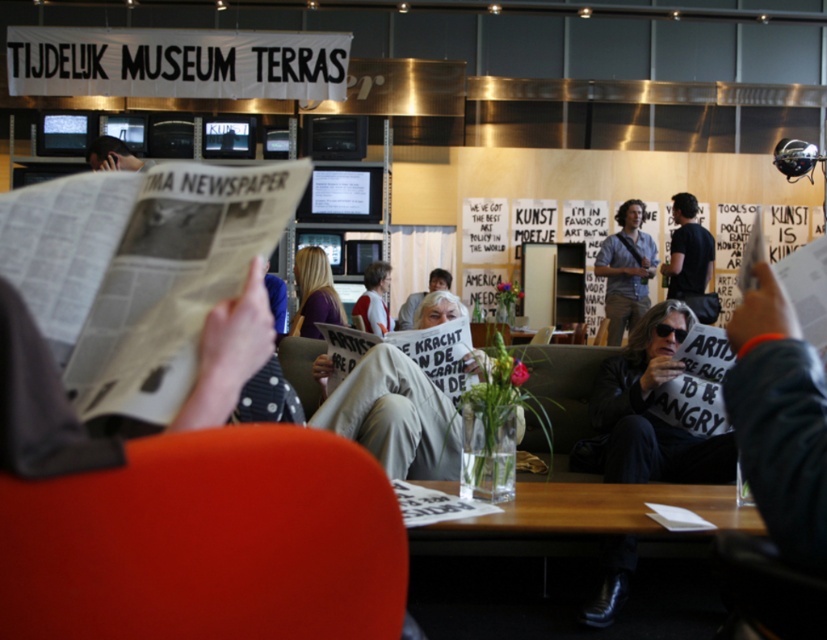
Is purple fabric shirt at center wider than white paper banner at center?

No.

Does purple fabric shirt at center appear over white paper banner at center?

No, purple fabric shirt at center is not above white paper banner at center.

Between point (327, 300) and point (410, 317), which one is positioned in front?

Point (327, 300) is in front.

This screenshot has height=640, width=827. I want to click on purple fabric shirt at center, so click(314, 292).

Who is higher up, matte red armchair at lower left or purple fabric shirt at center?

purple fabric shirt at center is above.

Where is `matte red armchair at lower left`? matte red armchair at lower left is located at coordinates (208, 541).

This screenshot has height=640, width=827. What are the coordinates of `matte red armchair at lower left` in the screenshot? It's located at (208, 541).

Which is below, blue denim shirt at center or leather armchair at center?

leather armchair at center is lower down.

Does blue denim shirt at center appear on the left side of leather armchair at center?

In fact, blue denim shirt at center is to the right of leather armchair at center.

Which is behind, point (638, 212) or point (308, 372)?

The point (638, 212) is more distant.

The image size is (827, 640). I want to click on blue denim shirt at center, so click(x=625, y=269).